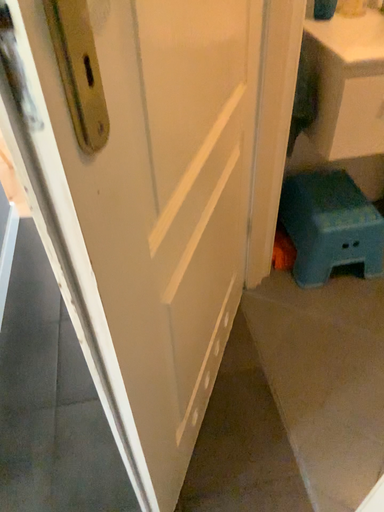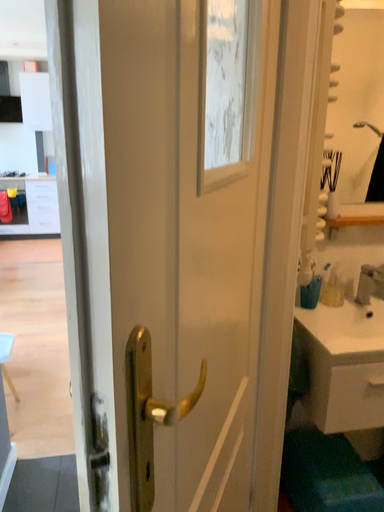
Question: How did the camera likely rotate when shooting the video?

Choices:
 (A) rotated upward
 (B) rotated downward

Answer: (A)